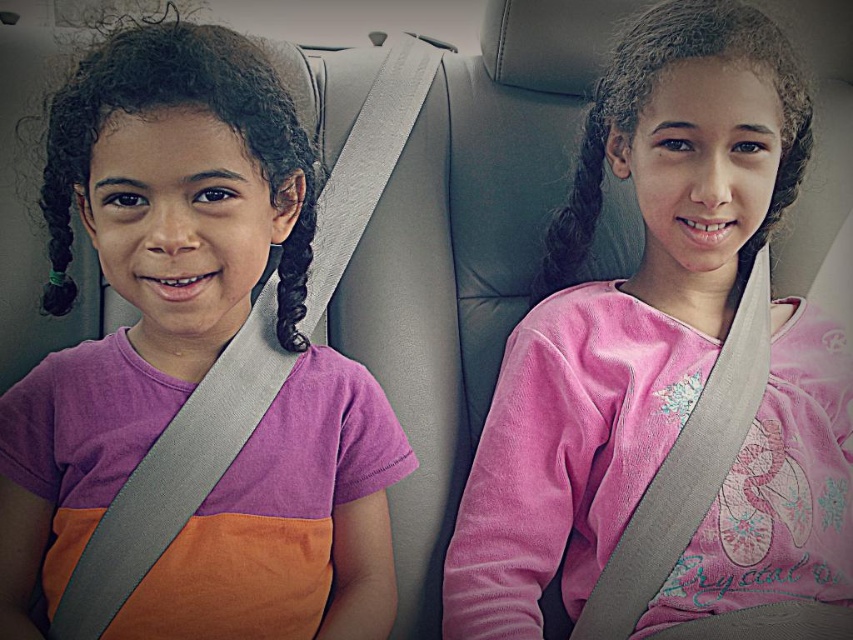
Question: Is matte purple shirt at left positioned in front of pink velvety shirt at center?

Choices:
 (A) no
 (B) yes

Answer: (B)

Question: Which point is closer to the camera?

Choices:
 (A) matte purple shirt at left
 (B) pink velvety shirt at center

Answer: (A)

Question: Considering the relative positions of matte purple shirt at left and pink velvety shirt at center in the image provided, where is matte purple shirt at left located with respect to pink velvety shirt at center?

Choices:
 (A) left
 (B) right

Answer: (A)

Question: Does matte purple shirt at left have a larger size compared to pink velvety shirt at center?

Choices:
 (A) yes
 (B) no

Answer: (B)